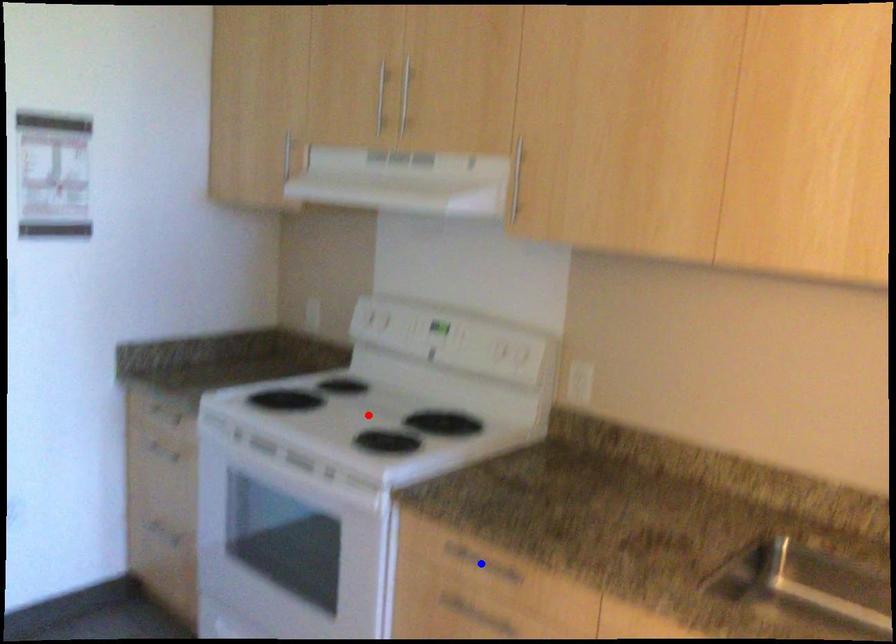
Question: Two points are marked on the image. Which point is closer to the camera?

Choices:
 (A) Blue point is closer.
 (B) Red point is closer.

Answer: (A)